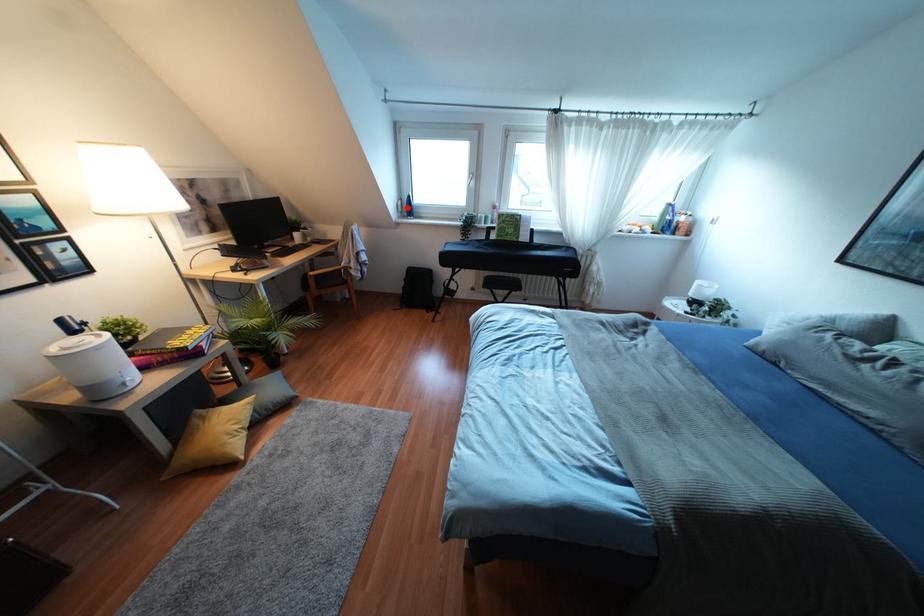
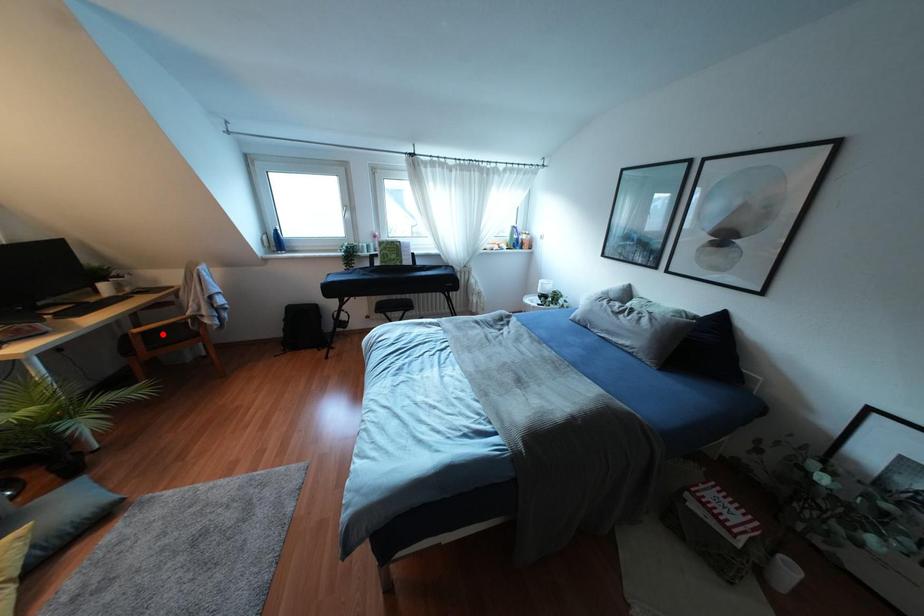
I am providing you with two images of the same scene from different viewpoints. A red point is marked on the first image and another point is marked on the second image. Does the point marked in image1 correspond to the same location as the one in image2?

No